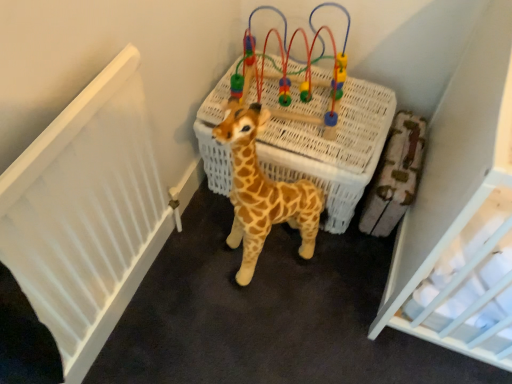
Question: Can you confirm if wooden bead maze at center is wider than white wicker basket at center?

Choices:
 (A) yes
 (B) no

Answer: (B)

Question: Is wooden bead maze at center not near white wicker basket at center?

Choices:
 (A) yes
 (B) no

Answer: (B)

Question: From a real-world perspective, is wooden bead maze at center below white wicker basket at center?

Choices:
 (A) no
 (B) yes

Answer: (A)

Question: Are wooden bead maze at center and white wicker basket at center beside each other?

Choices:
 (A) yes
 (B) no

Answer: (B)

Question: Could white wicker basket at center be considered to be inside wooden bead maze at center?

Choices:
 (A) no
 (B) yes

Answer: (A)

Question: Could you tell me if wooden bead maze at center is facing white wicker basket at center?

Choices:
 (A) yes
 (B) no

Answer: (B)

Question: From the image's perspective, is white wicker basket at center on wooden bead maze at center?

Choices:
 (A) yes
 (B) no

Answer: (B)

Question: Considering the relative sizes of white wicker basket at center and wooden bead maze at center in the image provided, is white wicker basket at center bigger than wooden bead maze at center?

Choices:
 (A) yes
 (B) no

Answer: (A)

Question: Is white wicker basket at center positioned far away from wooden bead maze at center?

Choices:
 (A) yes
 (B) no

Answer: (B)

Question: Considering the relative sizes of white wicker basket at center and wooden bead maze at center in the image provided, is white wicker basket at center taller than wooden bead maze at center?

Choices:
 (A) no
 (B) yes

Answer: (B)

Question: From the image's perspective, does white wicker basket at center appear lower than wooden bead maze at center?

Choices:
 (A) yes
 (B) no

Answer: (A)

Question: From a real-world perspective, is white wicker basket at center positioned under wooden bead maze at center based on gravity?

Choices:
 (A) no
 (B) yes

Answer: (B)

Question: From a real-world perspective, is white wicker basket at center on top of spotted plush giraffe at center?

Choices:
 (A) yes
 (B) no

Answer: (B)